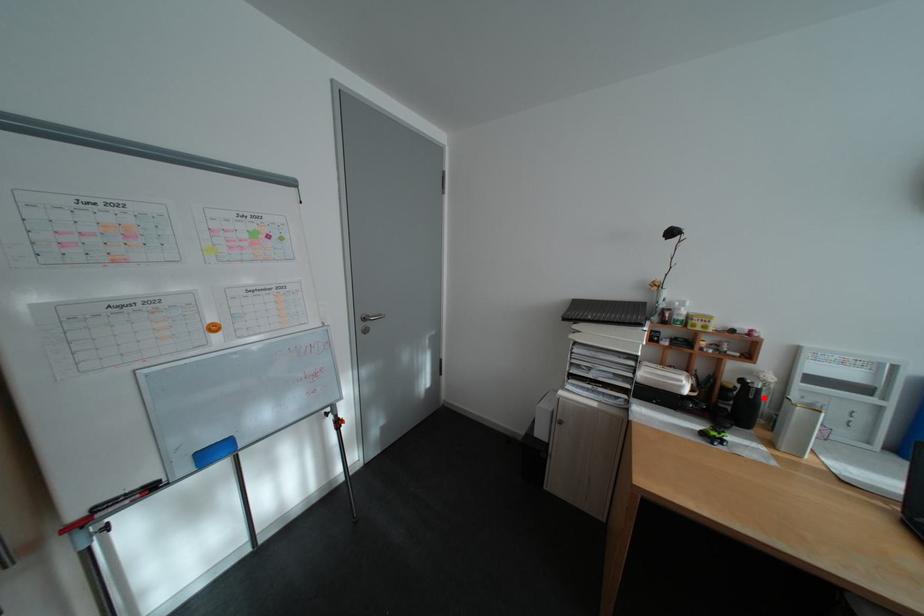
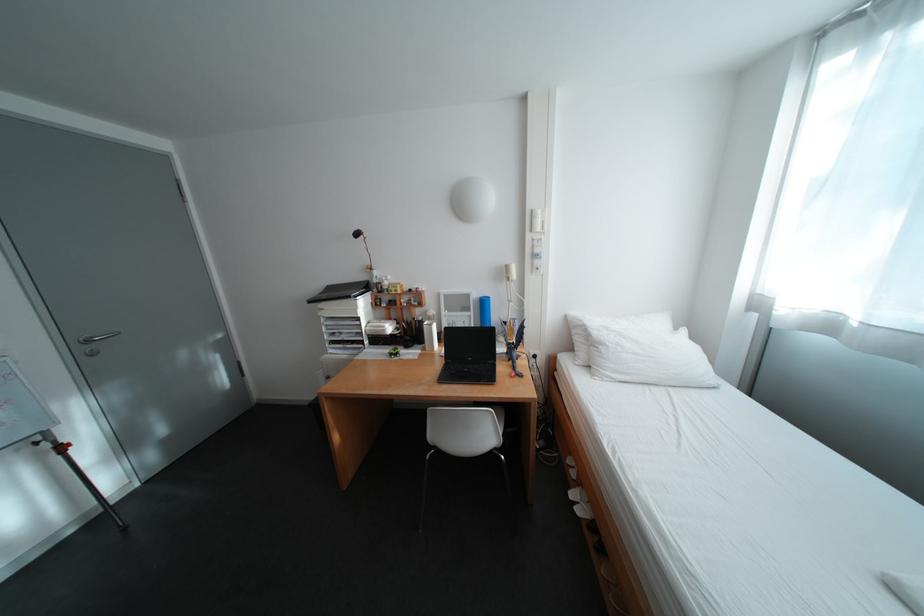
Question: I am providing you with two images of the same scene from different viewpoints. In image1, a red point is highlighted. Considering the same 3D point in image2, which of the following is correct?

Choices:
 (A) It is closer
 (B) It is farther

Answer: (B)